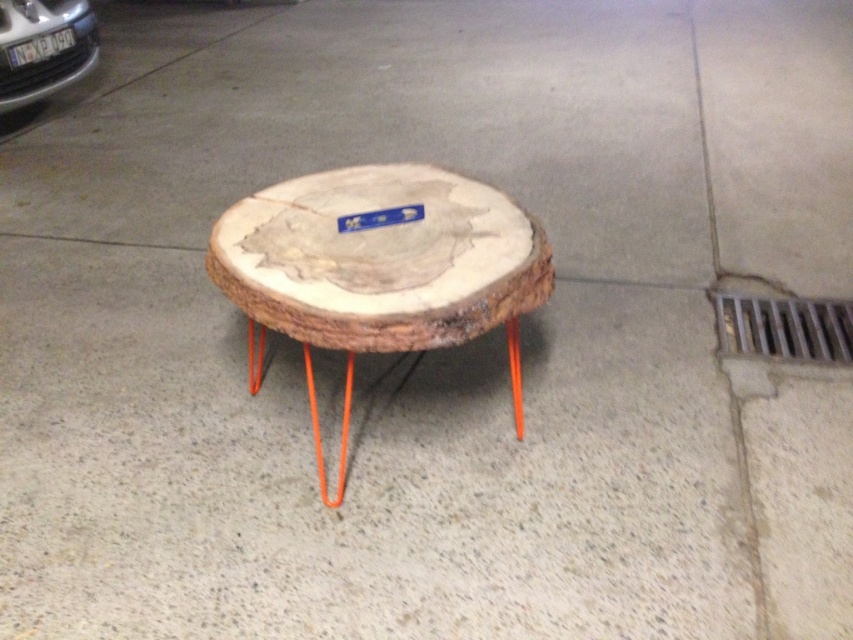
Can you confirm if natural wood table at center is bigger than matte black car at upper left?

Correct, natural wood table at center is larger in size than matte black car at upper left.

The height and width of the screenshot is (640, 853). I want to click on natural wood table at center, so coord(379,268).

At what (x,y) coordinates should I click in order to perform the action: click on natural wood table at center. Please return your answer as a coordinate pair (x, y). The width and height of the screenshot is (853, 640). Looking at the image, I should click on (379, 268).